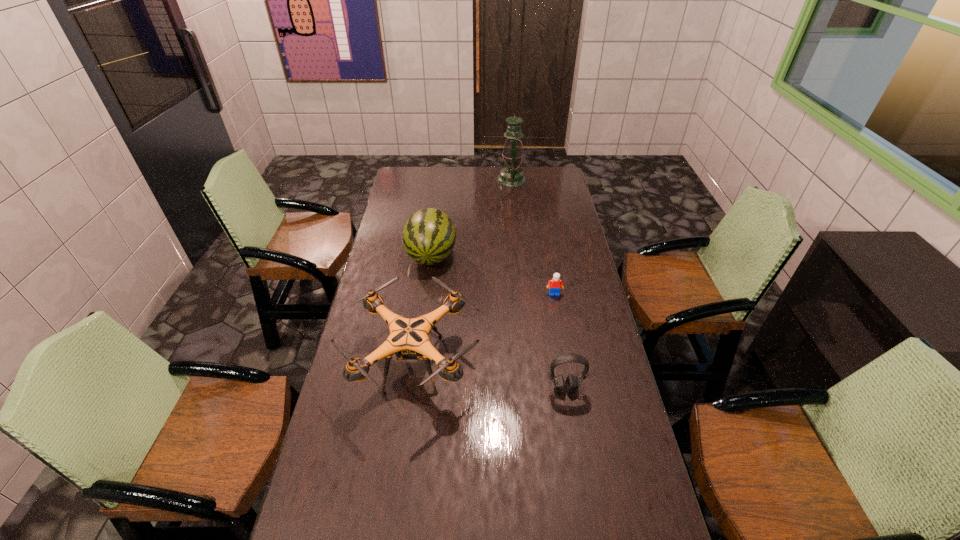
Locate an element on the screen. The width and height of the screenshot is (960, 540). vacant space located on the front-facing side of the second shortest object is located at coordinates (585, 508).

Where is `free space located on the face of the third nearest object`? This screenshot has height=540, width=960. free space located on the face of the third nearest object is located at coordinates (568, 372).

This screenshot has width=960, height=540. I want to click on object that is at the far edge, so click(x=511, y=176).

Where is `watermelon located in the left edge section of the desktop`? watermelon located in the left edge section of the desktop is located at coordinates (428, 238).

Identify the location of drone at the left edge. This screenshot has width=960, height=540. (408, 339).

The height and width of the screenshot is (540, 960). Identify the location of headset present at the right edge. click(x=571, y=383).

Image resolution: width=960 pixels, height=540 pixels. Identify the location of Lego located in the right edge section of the desktop. (555, 284).

Image resolution: width=960 pixels, height=540 pixels. Find the location of `free space at the far edge of the desktop`. free space at the far edge of the desktop is located at coordinates (479, 184).

What are the coordinates of `free spot at the left edge of the desktop` in the screenshot? It's located at (366, 312).

Image resolution: width=960 pixels, height=540 pixels. What are the coordinates of `vacant point at the right edge` in the screenshot? It's located at (636, 457).